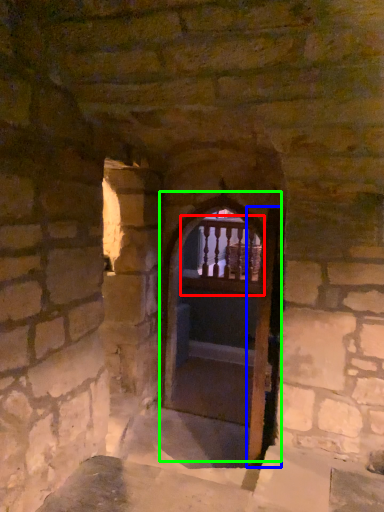
Question: Which object is the closest to the balcony (highlighted by a red box)? Choose among these: screen door (highlighted by a blue box) or door (highlighted by a green box).

Choices:
 (A) screen door
 (B) door

Answer: (B)